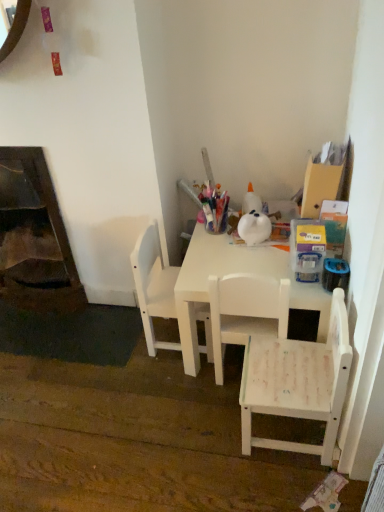
This screenshot has width=384, height=512. What are the coordinates of `blank space to the left of white matte chair at lower right, marked as the third chair in a left-to-right arrangement` in the screenshot? It's located at (202, 433).